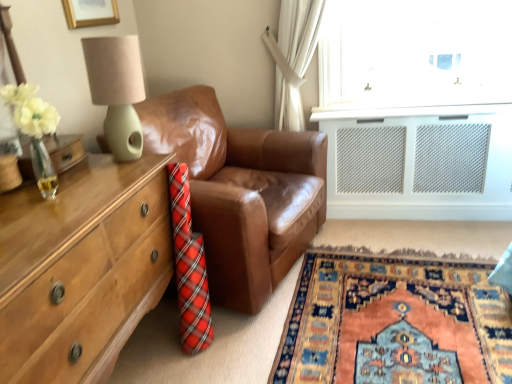
Question: Is wooden chest of drawers at left in contact with brown leather couch at center?

Choices:
 (A) no
 (B) yes

Answer: (A)

Question: From a real-world perspective, is wooden chest of drawers at left physically below brown leather couch at center?

Choices:
 (A) no
 (B) yes

Answer: (B)

Question: Does wooden chest of drawers at left contain brown leather couch at center?

Choices:
 (A) no
 (B) yes

Answer: (A)

Question: Is wooden chest of drawers at left completely or partially outside of brown leather couch at center?

Choices:
 (A) yes
 (B) no

Answer: (A)

Question: Considering the relative sizes of wooden chest of drawers at left and brown leather couch at center in the image provided, is wooden chest of drawers at left wider than brown leather couch at center?

Choices:
 (A) no
 (B) yes

Answer: (A)

Question: Does wooden chest of drawers at left have a lesser height compared to brown leather couch at center?

Choices:
 (A) yes
 (B) no

Answer: (A)

Question: Is carpet with intricate patterns at lower right further to the viewer compared to wooden chest of drawers at left?

Choices:
 (A) no
 (B) yes

Answer: (B)

Question: Does carpet with intricate patterns at lower right have a greater height compared to wooden chest of drawers at left?

Choices:
 (A) no
 (B) yes

Answer: (A)

Question: Is carpet with intricate patterns at lower right surrounding wooden chest of drawers at left?

Choices:
 (A) yes
 (B) no

Answer: (B)

Question: Can you confirm if carpet with intricate patterns at lower right is shorter than wooden chest of drawers at left?

Choices:
 (A) no
 (B) yes

Answer: (B)

Question: Can you confirm if carpet with intricate patterns at lower right is smaller than wooden chest of drawers at left?

Choices:
 (A) yes
 (B) no

Answer: (A)

Question: Considering the relative sizes of carpet with intricate patterns at lower right and wooden chest of drawers at left in the image provided, is carpet with intricate patterns at lower right thinner than wooden chest of drawers at left?

Choices:
 (A) yes
 (B) no

Answer: (B)

Question: From a real-world perspective, is brown leather couch at center positioned over carpet with intricate patterns at lower right based on gravity?

Choices:
 (A) yes
 (B) no

Answer: (A)